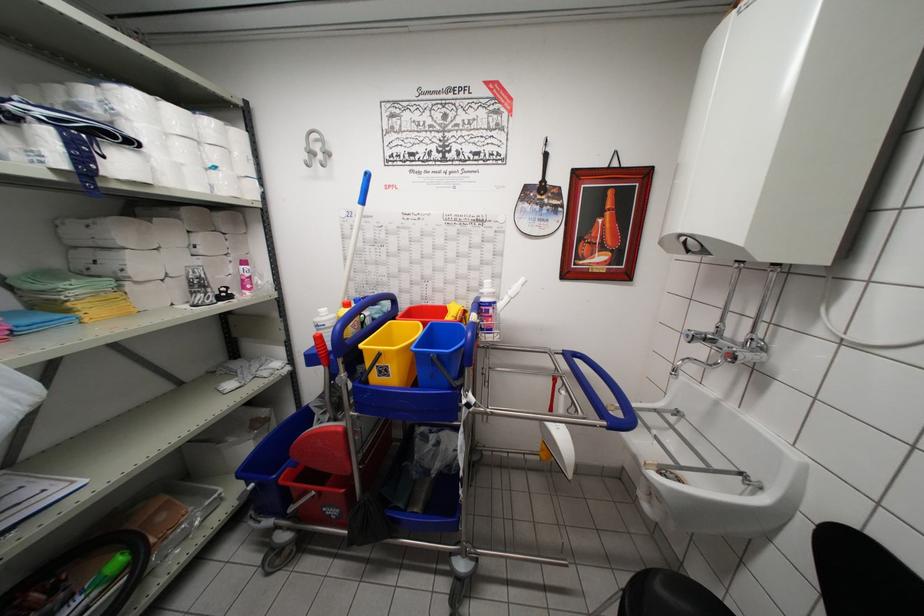
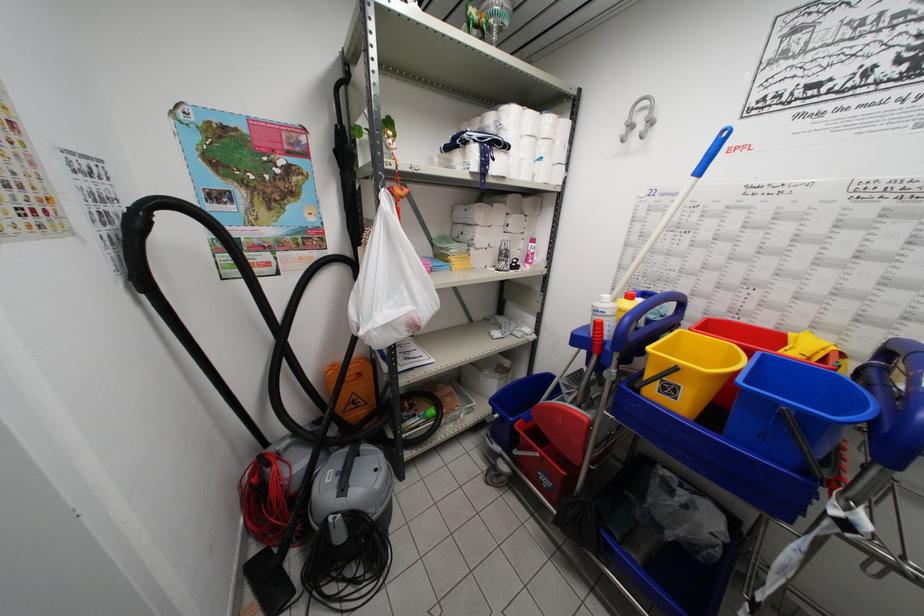
Question: The camera is either moving clockwise (left) or counter-clockwise (right) around the object. The first image is from the beginning of the video and the second image is from the end. Is the camera moving left or right when shooting the video?

Choices:
 (A) Left
 (B) Right

Answer: (B)